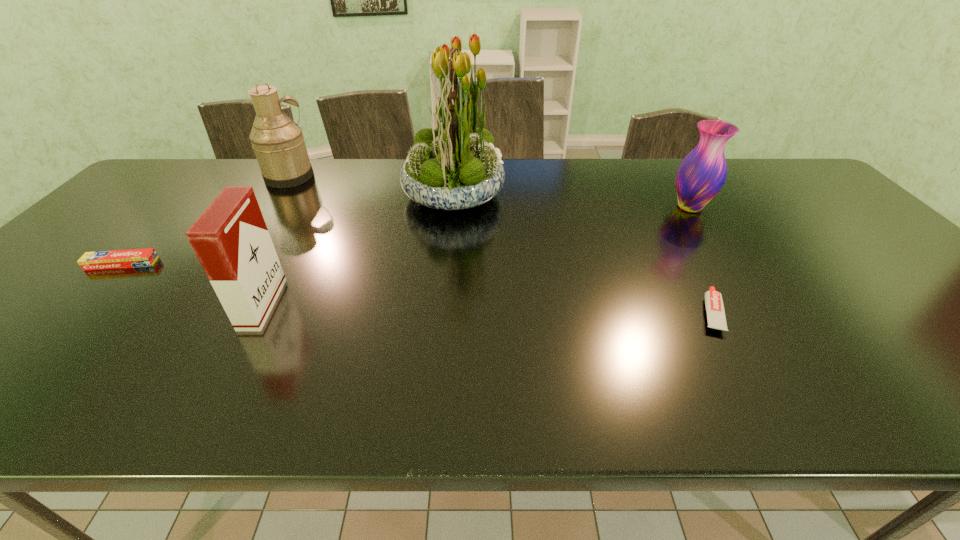
The width and height of the screenshot is (960, 540). What are the coordinates of `free space that satisfies the following two spatial constraints: 1. on the back side of the farther toothpaste; 2. on the left side of the rightmost object` in the screenshot? It's located at (177, 207).

Image resolution: width=960 pixels, height=540 pixels. Find the location of `free space that satisfies the following two spatial constraints: 1. on the front-facing side of the fourth object from left to right; 2. on the right side of the nearer toothpaste`. free space that satisfies the following two spatial constraints: 1. on the front-facing side of the fourth object from left to right; 2. on the right side of the nearer toothpaste is located at coordinates (443, 313).

I want to click on free space in the image that satisfies the following two spatial constraints: 1. on the back side of the second object from left to right; 2. on the right side of the left toothpaste, so click(205, 177).

This screenshot has width=960, height=540. I want to click on free space that satisfies the following two spatial constraints: 1. on the front-facing side of the tallest object; 2. on the back side of the right toothpaste, so [x=443, y=313].